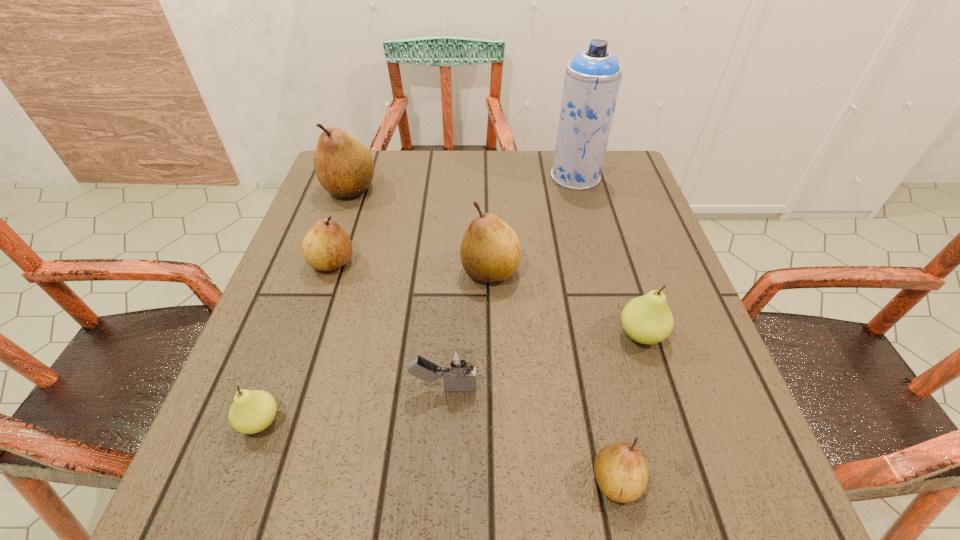
Locate an element on the screen. vacant space at the near edge of the desktop is located at coordinates (418, 483).

Identify the location of vacant space at the left edge of the desktop. The width and height of the screenshot is (960, 540). (323, 374).

Where is `free region at the right edge of the desktop`? free region at the right edge of the desktop is located at coordinates (614, 220).

Find the location of a particular element. free space at the far right corner of the desktop is located at coordinates [x=640, y=193].

Identify the location of vacant space in between the second smallest brown pear and the blue aerosol can. This screenshot has height=540, width=960. (454, 220).

You are a GUI agent. You are given a task and a screenshot of the screen. Output one action in this format:
    pyautogui.click(x=<x>, y=<y>)
    Task: Click on the vacant area that lies between the second nearest pear and the fifth pear from left to right
    
    Given the screenshot: What is the action you would take?
    pyautogui.click(x=439, y=451)

This screenshot has width=960, height=540. Identify the location of unoccupied area between the nearest object and the right green pear. (629, 408).

At what (x,y) coordinates should I click in order to perform the action: click on free space between the farthest pear and the left green pear. Please return your answer as a coordinate pair (x, y). The width and height of the screenshot is (960, 540). Looking at the image, I should click on (305, 305).

Identify the location of unoccupied area between the igniter and the rightmost brown pear. The width and height of the screenshot is (960, 540). (530, 434).

Find the location of a particular element. Image resolution: width=960 pixels, height=540 pixels. empty location between the igniter and the tallest pear is located at coordinates (396, 288).